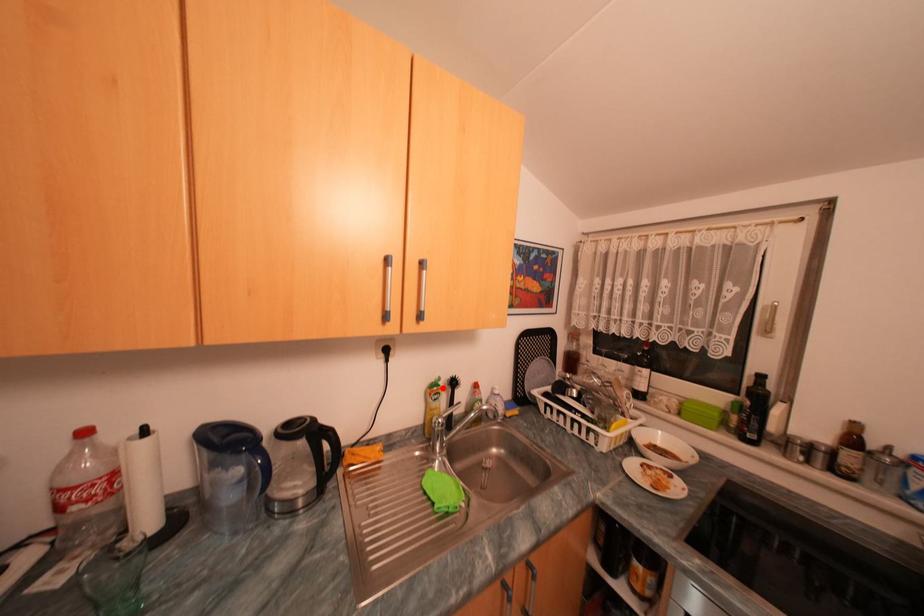
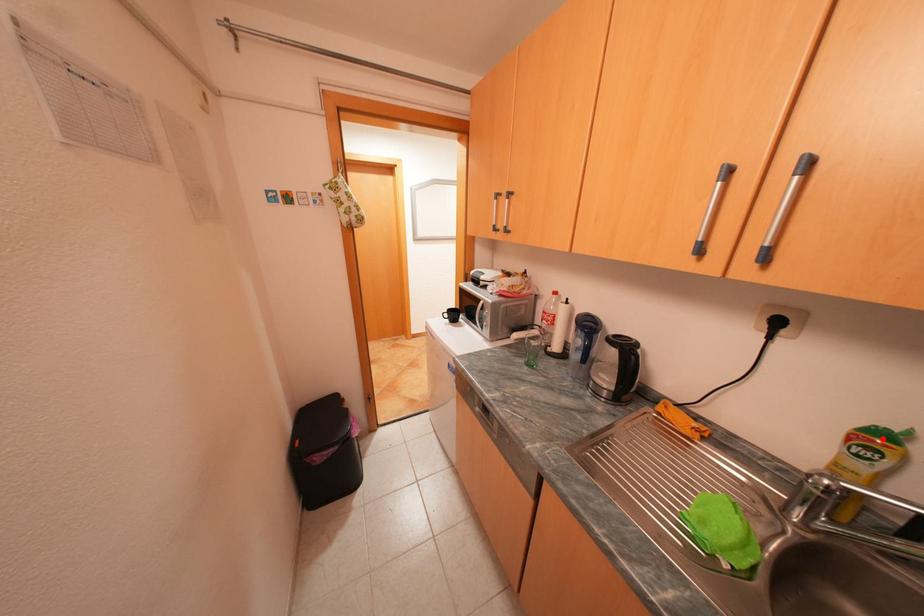
I am providing you with two images of the same scene from different viewpoints. A red point is marked on the first image and another point is marked on the second image. Are the points marked in image1 and image2 representing the same 3D position?

Yes